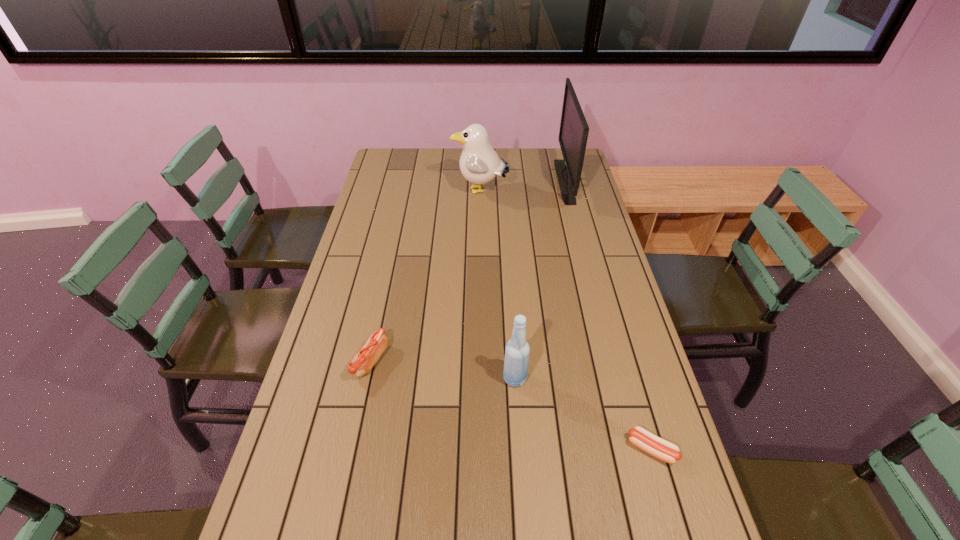
Locate an element on the screen. The height and width of the screenshot is (540, 960). the tallest object is located at coordinates (573, 134).

Where is `the second tallest object`? The height and width of the screenshot is (540, 960). the second tallest object is located at coordinates (479, 163).

Locate an element on the screen. bottle is located at coordinates (516, 362).

This screenshot has height=540, width=960. I want to click on the left sausage, so click(x=363, y=361).

At what (x,y) coordinates should I click in order to perform the action: click on the farther sausage. Please return your answer as a coordinate pair (x, y). Image resolution: width=960 pixels, height=540 pixels. Looking at the image, I should click on (363, 361).

Where is `the right sausage`? the right sausage is located at coordinates (662, 449).

Where is `the nearest object`? Image resolution: width=960 pixels, height=540 pixels. the nearest object is located at coordinates (662, 449).

Find the location of a particular element. The height and width of the screenshot is (540, 960). vacant space located on the front-facing side of the tallest object is located at coordinates (464, 181).

At what (x,y) coordinates should I click in order to perform the action: click on blank space located on the front-facing side of the tallest object. Please return your answer as a coordinate pair (x, y). Looking at the image, I should click on (506, 181).

Locate an element on the screen. free space located on the front-facing side of the tallest object is located at coordinates (473, 181).